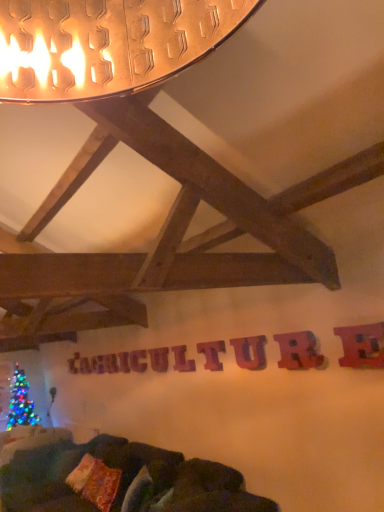
Question: Is velvet dark green couch at lower center to the left of wooden letter at center, which is the eighth letter in back-to-front order, from the viewer's perspective?

Choices:
 (A) no
 (B) yes

Answer: (B)

Question: Does velvet dark green couch at lower center have a lesser width compared to wooden letter at center, which is the eighth letter in back-to-front order?

Choices:
 (A) no
 (B) yes

Answer: (A)

Question: Is velvet dark green couch at lower center far from wooden letter at center, which is counted as the 2th letter, starting from the right?

Choices:
 (A) yes
 (B) no

Answer: (A)

Question: Considering the relative positions of velvet dark green couch at lower center and wooden letter at center, which is counted as the 2th letter, starting from the right, in the image provided, is velvet dark green couch at lower center in front of wooden letter at center, which is counted as the 2th letter, starting from the right,?

Choices:
 (A) yes
 (B) no

Answer: (A)

Question: From a real-world perspective, is velvet dark green couch at lower center located beneath wooden letter at center, which is the 2th letter in front-to-back order?

Choices:
 (A) yes
 (B) no

Answer: (A)

Question: From a real-world perspective, is wooden letter at center, the first letter in the back-to-front sequence, above or below wooden letter at center, which is counted as the 6th letter, starting from the left?

Choices:
 (A) below
 (B) above

Answer: (A)

Question: Is wooden letter at center, which is the 9th letter in front-to-back order, inside or outside of wooden letter at center, which ranks as the sixth letter in back-to-front order?

Choices:
 (A) inside
 (B) outside

Answer: (B)

Question: From their relative heights in the image, would you say wooden letter at center, which ranks as the 1th letter in left-to-right order, is taller or shorter than wooden letter at center, the fourth letter in the front-to-back sequence?

Choices:
 (A) short
 (B) tall

Answer: (B)

Question: Considering the positions of point (82, 359) and point (206, 352), is point (82, 359) closer or farther from the camera than point (206, 352)?

Choices:
 (A) closer
 (B) farther

Answer: (B)

Question: Considering the relative positions of wooden letter at center, which is the third letter in left-to-right order, and metallic red letter at upper right, acting as the ninth letter starting from the left, in the image provided, is wooden letter at center, which is the third letter in left-to-right order, to the left or to the right of metallic red letter at upper right, acting as the ninth letter starting from the left,?

Choices:
 (A) left
 (B) right

Answer: (A)

Question: From a real-world perspective, is wooden letter at center, which is the third letter in left-to-right order, above or below metallic red letter at upper right, the first letter when ordered from right to left?

Choices:
 (A) above
 (B) below

Answer: (B)

Question: From their relative heights in the image, would you say wooden letter at center, which is the third letter from back to front, is taller or shorter than metallic red letter at upper right, acting as the ninth letter starting from the left?

Choices:
 (A) tall
 (B) short

Answer: (B)

Question: Based on their sizes in the image, would you say wooden letter at center, positioned as the seventh letter in front-to-back order, is bigger or smaller than metallic red letter at upper right, the first letter when ordered from right to left?

Choices:
 (A) small
 (B) big

Answer: (A)

Question: In the image, is wooden letter at center, positioned as the 4th letter in back-to-front order, on the left side or the right side of velvet dark green couch at lower center?

Choices:
 (A) right
 (B) left

Answer: (A)

Question: In terms of size, does wooden letter at center, positioned as the 4th letter in back-to-front order, appear bigger or smaller than velvet dark green couch at lower center?

Choices:
 (A) small
 (B) big

Answer: (A)